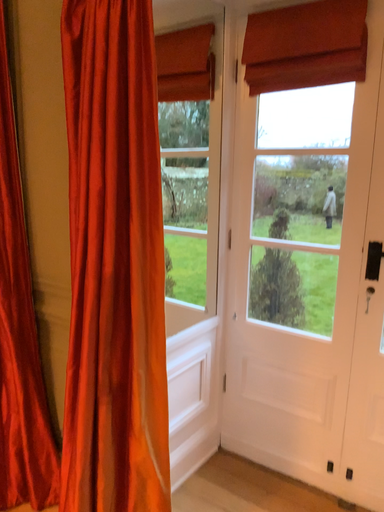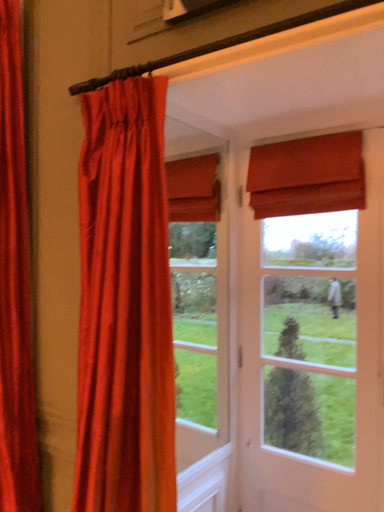
Question: Which way did the camera rotate in the video?

Choices:
 (A) rotated downward
 (B) rotated upward

Answer: (B)